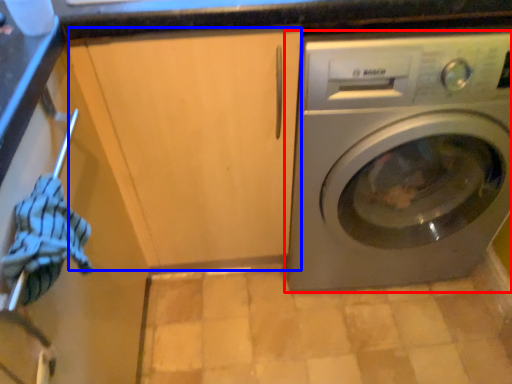
Question: Which point is closer to the camera, washing machine (highlighted by a red box) or cabinetry (highlighted by a blue box)?

Choices:
 (A) washing machine
 (B) cabinetry

Answer: (B)